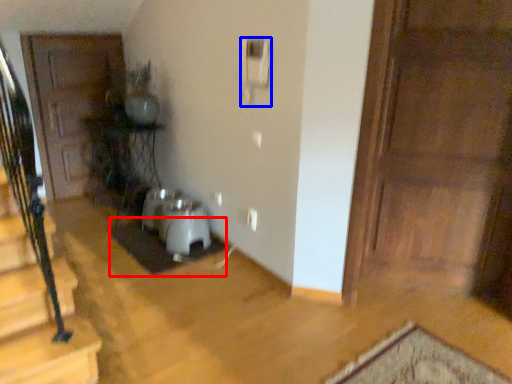
Question: Which object appears farthest to the camera in this image, doormat (highlighted by a red box) or corded phone (highlighted by a blue box)?

Choices:
 (A) doormat
 (B) corded phone

Answer: (A)